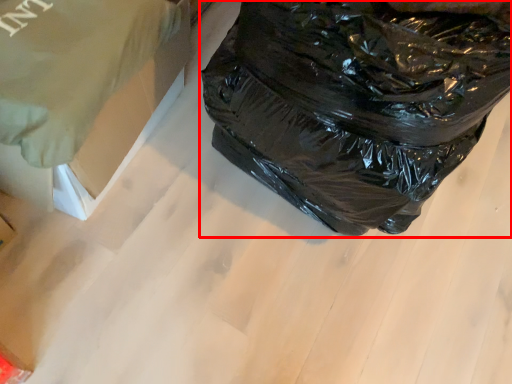
Question: Where is plastic bag (annotated by the red box) located in relation to cardboard box in the image?

Choices:
 (A) left
 (B) right

Answer: (B)